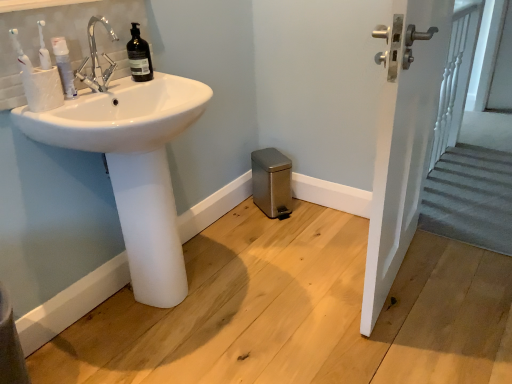
At what (x,y) coordinates should I click in order to perform the action: click on free spot in front of white glossy sink at left. Please return your answer as a coordinate pair (x, y). The width and height of the screenshot is (512, 384). Looking at the image, I should click on (163, 360).